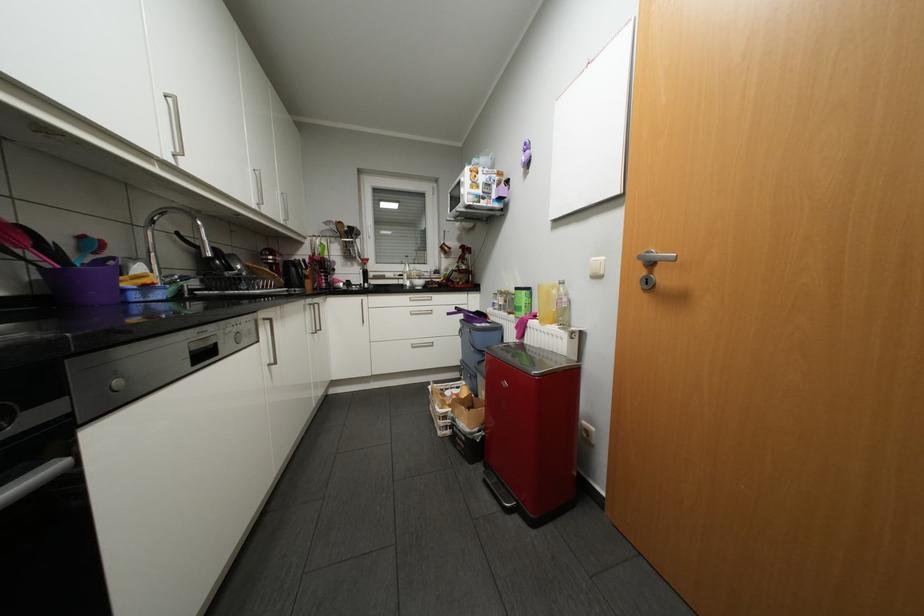
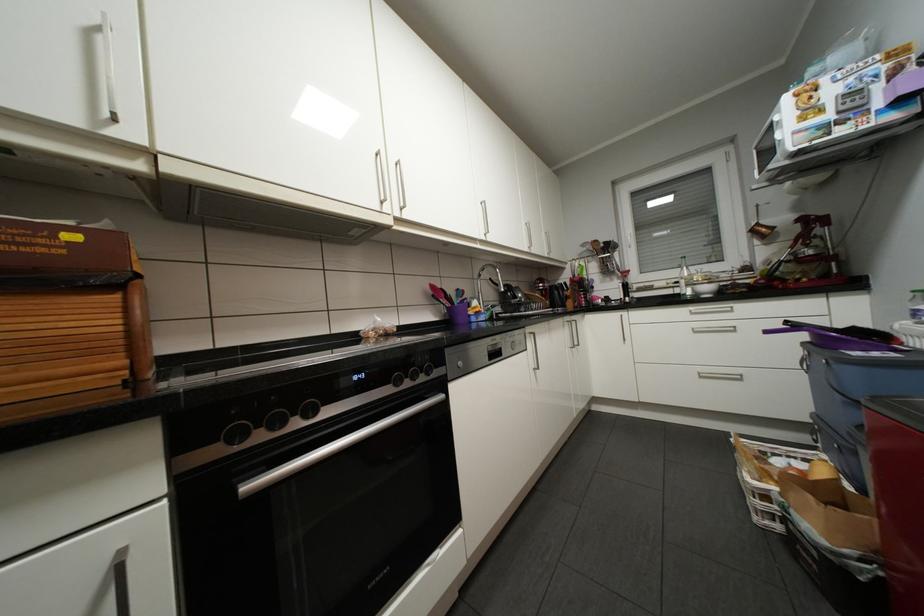
Locate, in the second image, the point that corresponds to point 419,300 in the first image.

(699, 313)